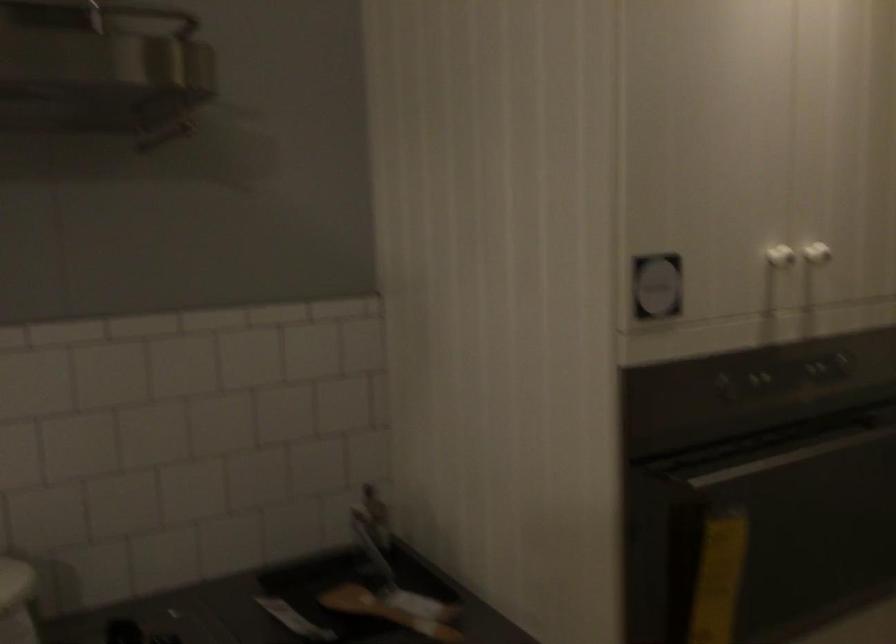
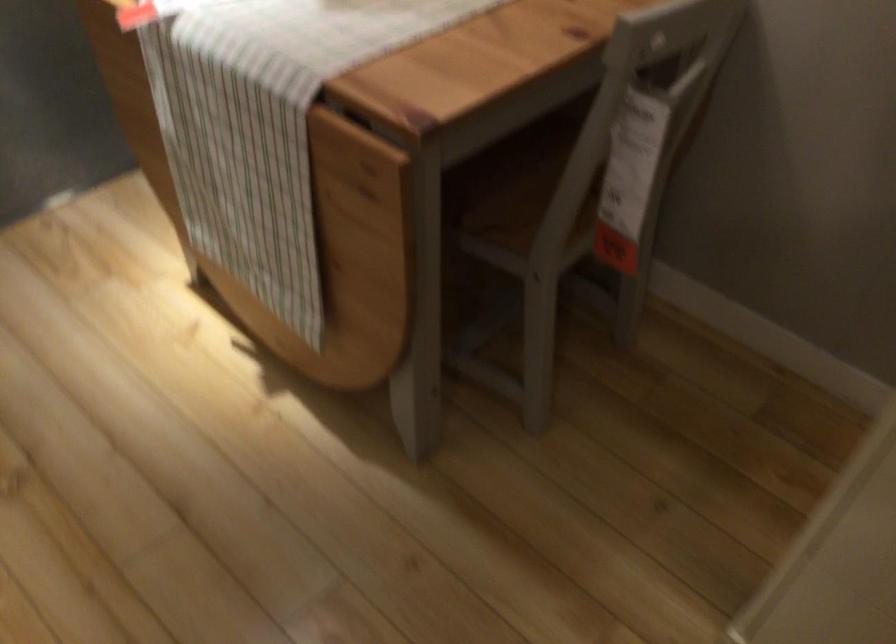
Based on the continuous images, in which direction is the camera rotating?

The camera's rotation is toward left-down.